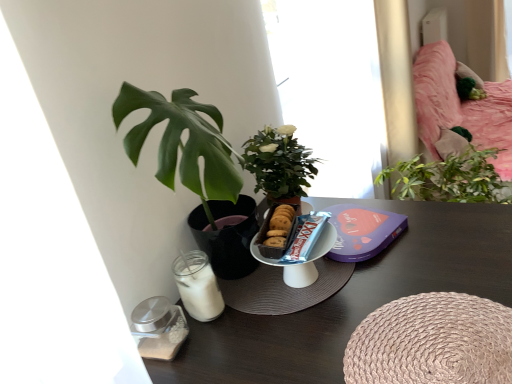
Question: From a real-world perspective, is blue foil chocolate bar at center over pink fabric bed at upper right?

Choices:
 (A) no
 (B) yes

Answer: (B)

Question: Considering the relative sizes of blue foil chocolate bar at center and pink fabric bed at upper right in the image provided, is blue foil chocolate bar at center wider than pink fabric bed at upper right?

Choices:
 (A) no
 (B) yes

Answer: (A)

Question: Can you confirm if blue foil chocolate bar at center is positioned to the left of pink fabric bed at upper right?

Choices:
 (A) yes
 (B) no

Answer: (A)

Question: Is blue foil chocolate bar at center located outside pink fabric bed at upper right?

Choices:
 (A) no
 (B) yes

Answer: (B)

Question: Can pink fabric bed at upper right be found inside blue foil chocolate bar at center?

Choices:
 (A) no
 (B) yes

Answer: (A)

Question: Considering the relative sizes of blue foil chocolate bar at center and pink fabric bed at upper right in the image provided, is blue foil chocolate bar at center taller than pink fabric bed at upper right?

Choices:
 (A) no
 (B) yes

Answer: (A)

Question: Does pink fabric bed at upper right have a lesser height compared to blue foil chocolate bar at center?

Choices:
 (A) yes
 (B) no

Answer: (B)

Question: Does pink fabric bed at upper right turn towards blue foil chocolate bar at center?

Choices:
 (A) yes
 (B) no

Answer: (B)

Question: Can you confirm if pink fabric bed at upper right is smaller than blue foil chocolate bar at center?

Choices:
 (A) yes
 (B) no

Answer: (B)

Question: From a real-world perspective, is pink fabric bed at upper right on blue foil chocolate bar at center?

Choices:
 (A) yes
 (B) no

Answer: (B)

Question: Can you confirm if pink fabric bed at upper right is taller than blue foil chocolate bar at center?

Choices:
 (A) no
 (B) yes

Answer: (B)

Question: Considering the relative positions of pink fabric bed at upper right and blue foil chocolate bar at center in the image provided, is pink fabric bed at upper right behind blue foil chocolate bar at center?

Choices:
 (A) yes
 (B) no

Answer: (A)

Question: Is wooden table at lower left next to transparent glass window at center and touching it?

Choices:
 (A) yes
 (B) no

Answer: (B)